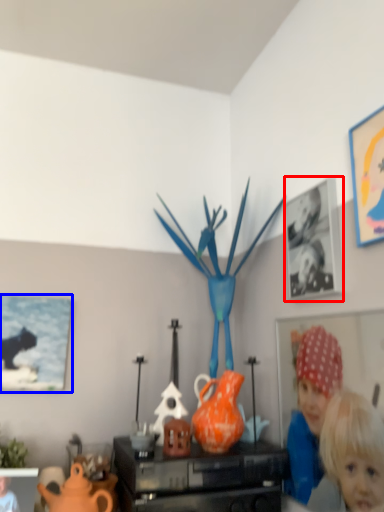
Question: Which object appears farthest to the camera in this image, picture frame (highlighted by a red box) or picture frame (highlighted by a blue box)?

Choices:
 (A) picture frame
 (B) picture frame

Answer: (B)